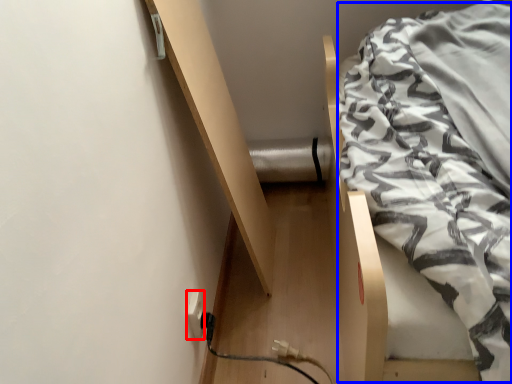
Question: Among these objects, which one is nearest to the camera, electric outlet (highlighted by a red box) or blanket (highlighted by a blue box)?

Choices:
 (A) electric outlet
 (B) blanket

Answer: (B)